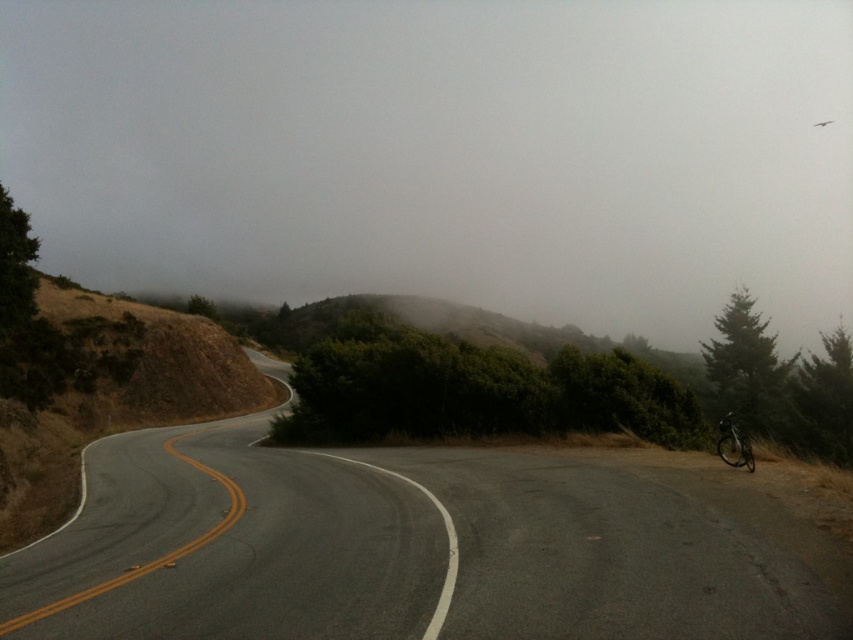
Question: Is asphalt road at center wider than shiny black bicycle at right?

Choices:
 (A) no
 (B) yes

Answer: (B)

Question: Which of the following is the closest to the observer?

Choices:
 (A) (173, 509)
 (B) (729, 452)

Answer: (A)

Question: Does asphalt road at center appear over shiny black bicycle at right?

Choices:
 (A) yes
 (B) no

Answer: (B)

Question: Among these objects, which one is farthest from the camera?

Choices:
 (A) shiny black bicycle at right
 (B) asphalt road at center

Answer: (A)

Question: Is asphalt road at center to the right of shiny black bicycle at right from the viewer's perspective?

Choices:
 (A) no
 (B) yes

Answer: (A)